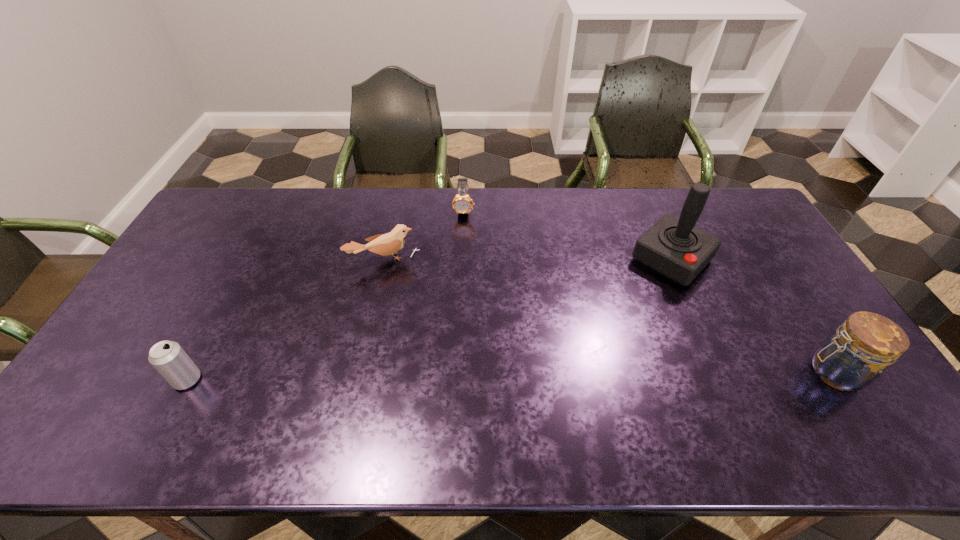
I want to click on vacant region at the far right corner, so click(735, 189).

Locate an element on the screen. Image resolution: width=960 pixels, height=540 pixels. unoccupied position between the leftmost object and the jar is located at coordinates tap(511, 376).

Locate an element on the screen. The height and width of the screenshot is (540, 960). unoccupied position between the leftmost object and the farthest object is located at coordinates tap(325, 294).

Image resolution: width=960 pixels, height=540 pixels. Find the location of `free area in between the watch and the tallest object`. free area in between the watch and the tallest object is located at coordinates (568, 234).

Find the location of `free space between the bird and the tallest object`. free space between the bird and the tallest object is located at coordinates (528, 260).

Identify the location of vacant area between the beer can and the farthest object. The height and width of the screenshot is (540, 960). (325, 294).

I want to click on vacant area that lies between the bird and the joystick, so click(x=528, y=260).

At what (x,y) coordinates should I click in order to perform the action: click on vacant space in between the watch and the rightmost object. Please return your answer as a coordinate pair (x, y). Image resolution: width=960 pixels, height=540 pixels. Looking at the image, I should click on (649, 291).

At what (x,y) coordinates should I click in order to perform the action: click on free area in between the watch and the rightmost object. Please return your answer as a coordinate pair (x, y). The image size is (960, 540). Looking at the image, I should click on (649, 291).

This screenshot has width=960, height=540. In order to click on empty location between the third object from right to left and the second tallest object in this screenshot , I will do point(649,291).